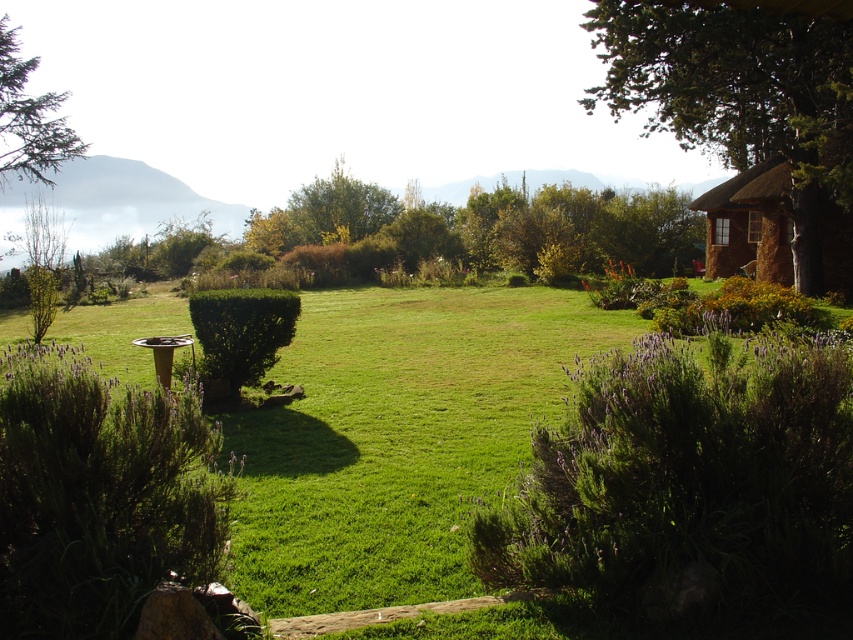
Between point (755, 176) and point (213, 336), which one is positioned behind?

Positioned behind is point (755, 176).

Which of these two, brown thatched hut at right or green leafy hedge at center, stands taller?

brown thatched hut at right

Is point (836, 246) behind point (219, 340)?

Yes, point (836, 246) is farther from viewer.

You are a GUI agent. You are given a task and a screenshot of the screen. Output one action in this format:
    pyautogui.click(x=<x>, y=<y>)
    Task: Click on the brown thatched hut at right
    Image resolution: width=853 pixels, height=640 pixels.
    Given the screenshot: What is the action you would take?
    pyautogui.click(x=751, y=221)

Which is more to the left, green leafy hedge at center-left or green leafy hedge at center?

Positioned to the left is green leafy hedge at center.

Between green leafy hedge at center-left and green leafy hedge at center, which one is positioned lower?

green leafy hedge at center-left

Who is more forward, [76,580] or [265,310]?

Point [76,580] is more forward.

This screenshot has width=853, height=640. What are the coordinates of `green leafy hedge at center-left` in the screenshot? It's located at (100, 496).

Can you confirm if green leafy hedge at center-left is positioned above brown thatched hut at right?

No, green leafy hedge at center-left is not above brown thatched hut at right.

Does green leafy hedge at center-left come behind brown thatched hut at right?

No.

Locate an element on the screen. The width and height of the screenshot is (853, 640). green leafy hedge at center-left is located at coordinates (100, 496).

Find the location of `green leafy hedge at center-left`. green leafy hedge at center-left is located at coordinates (100, 496).